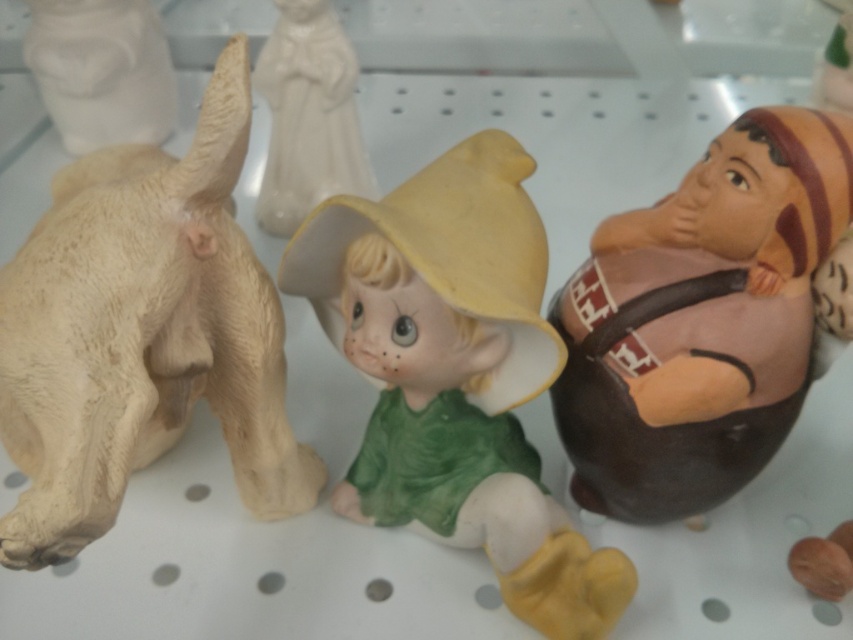
Question: Among these objects, which one is nearest to the camera?

Choices:
 (A) brown matte figure at right
 (B) matte porcelain doll at center

Answer: (B)

Question: Can you confirm if matte porcelain doll at center is smaller than white matte statue at upper center?

Choices:
 (A) no
 (B) yes

Answer: (A)

Question: Is beige matte animal at left wider than white matte statue at upper center?

Choices:
 (A) no
 (B) yes

Answer: (B)

Question: Which of the following is the farthest from the observer?

Choices:
 (A) beige matte animal at left
 (B) white matte statue at upper left
 (C) matte porcelain doll at center
 (D) white matte statue at upper center

Answer: (B)

Question: Does white matte statue at upper center lie in front of white matte statue at upper left?

Choices:
 (A) yes
 (B) no

Answer: (A)

Question: Which point appears closest to the camera in this image?

Choices:
 (A) (728, 248)
 (B) (264, 180)
 (C) (165, 177)

Answer: (C)